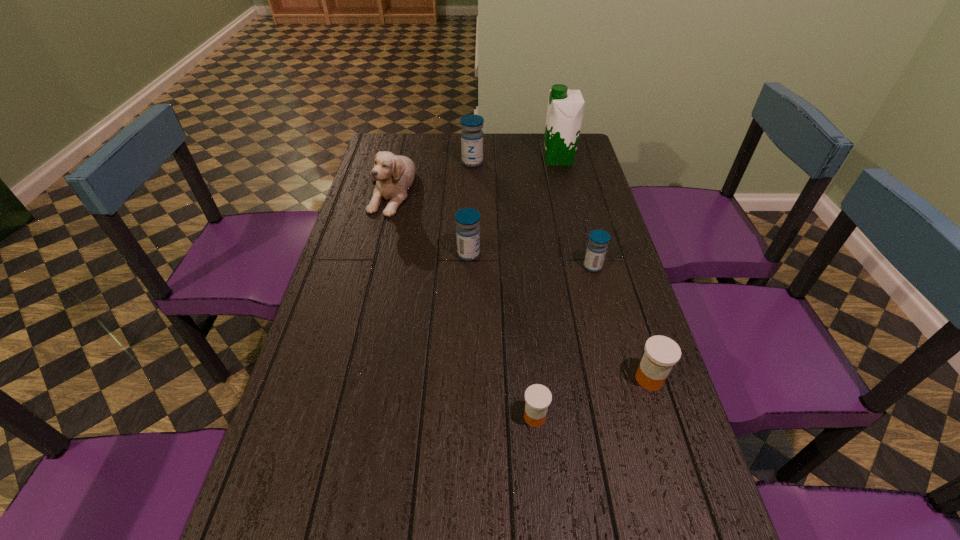
At what (x,y) coordinates should I click in order to perform the action: click on the bigger orange medicine. Please return your answer as a coordinate pair (x, y). The width and height of the screenshot is (960, 540). Looking at the image, I should click on (661, 353).

I want to click on the nearest medicine, so click(538, 397).

Locate an element on the screen. Image resolution: width=960 pixels, height=540 pixels. the shortest medicine is located at coordinates (538, 397).

In order to click on free spot located 0.190m on the front-facing side of the soya milk in this screenshot , I will do coord(495,159).

Identify the location of free location located on the front-facing side of the soya milk. This screenshot has width=960, height=540. (485, 159).

Identify the location of free point located on the front-facing side of the soya milk. (470, 159).

Identify the location of vacant region located 0.340m on the left of the tallest medicine. (375, 163).

The width and height of the screenshot is (960, 540). I want to click on free space located on the front-facing side of the leftmost object, so click(x=363, y=301).

The image size is (960, 540). In order to click on vacant space located 0.190m on the right of the fourth shortest medicine in this screenshot , I will do `click(541, 254)`.

This screenshot has height=540, width=960. What are the coordinates of `free location located on the front of the rightmost blue medicine` in the screenshot? It's located at (609, 329).